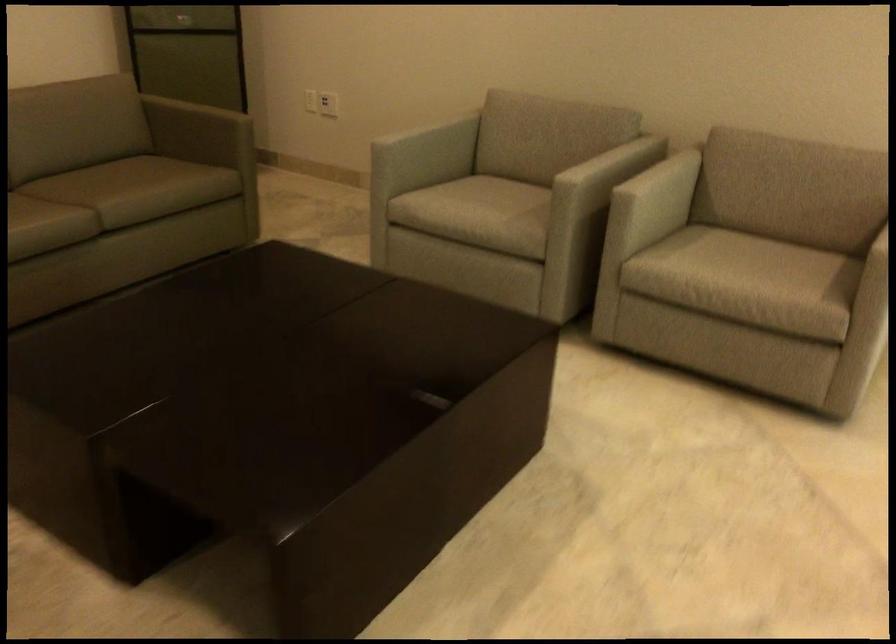
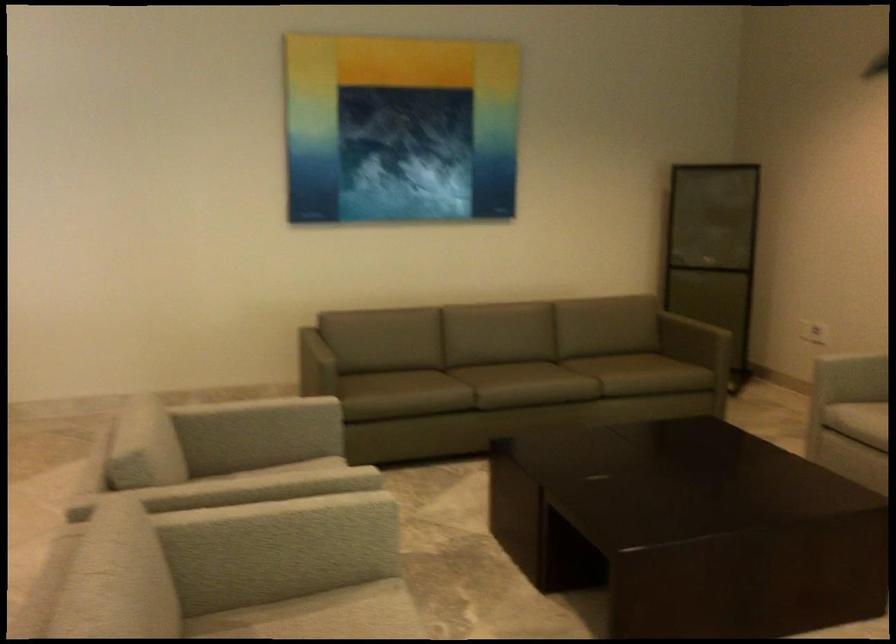
Where in the second image is the point corresponding to (227,114) from the first image?

(716, 333)